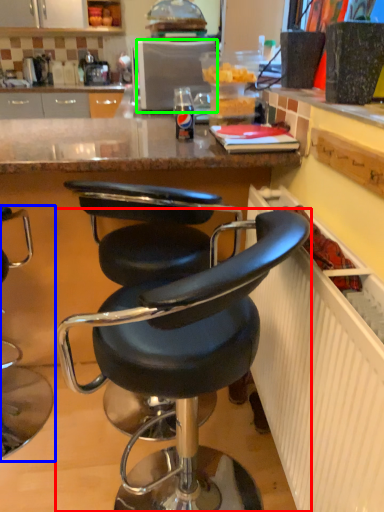
Question: Which is farther away from chair (highlighted by a red box)? chair (highlighted by a blue box) or appliance (highlighted by a green box)?

Choices:
 (A) chair
 (B) appliance

Answer: (B)